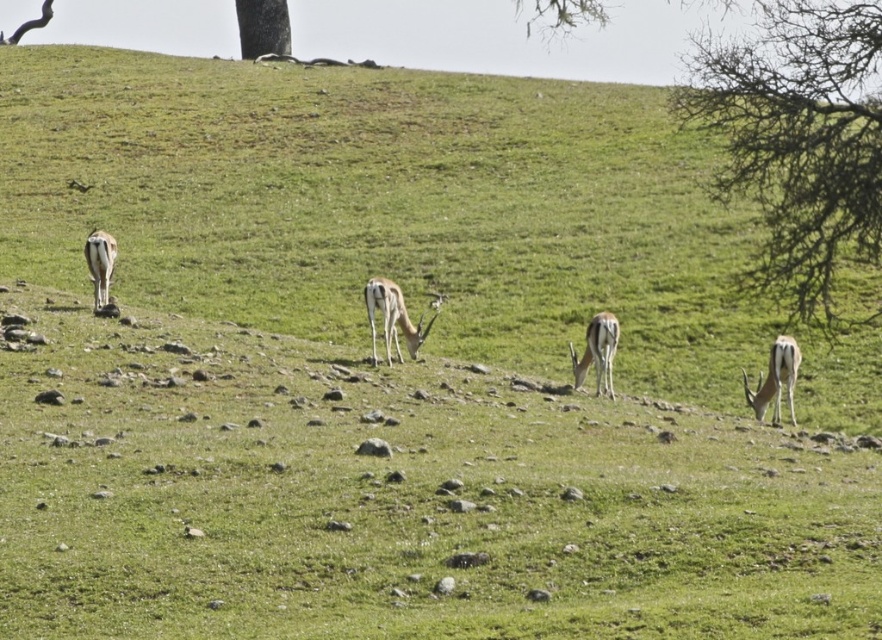
You are standing at the base of the hill in the scene. You want to climb up to the highest point of the hill where the bare branches at upper right are located. Which direction should you head towards from your current position?

The bare branches at upper right are located at point (797, 141), so you should head towards the upper right direction to reach them.

You are an antelope standing at point [262,33] and want to reach the water source located at point [96,266]. Considering the terrain, which direction should you move to get closer to the water source?

Since point [262,33] is closer to the viewer than point [96,266], you should move forward to reach the water source located at point [96,266].